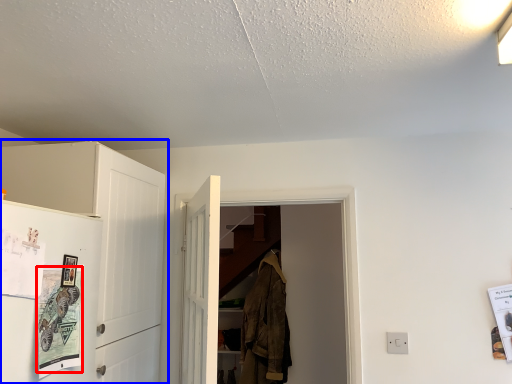
Question: Which of the following is the closest to the observer, poster (highlighted by a red box) or cabinetry (highlighted by a blue box)?

Choices:
 (A) poster
 (B) cabinetry

Answer: (A)